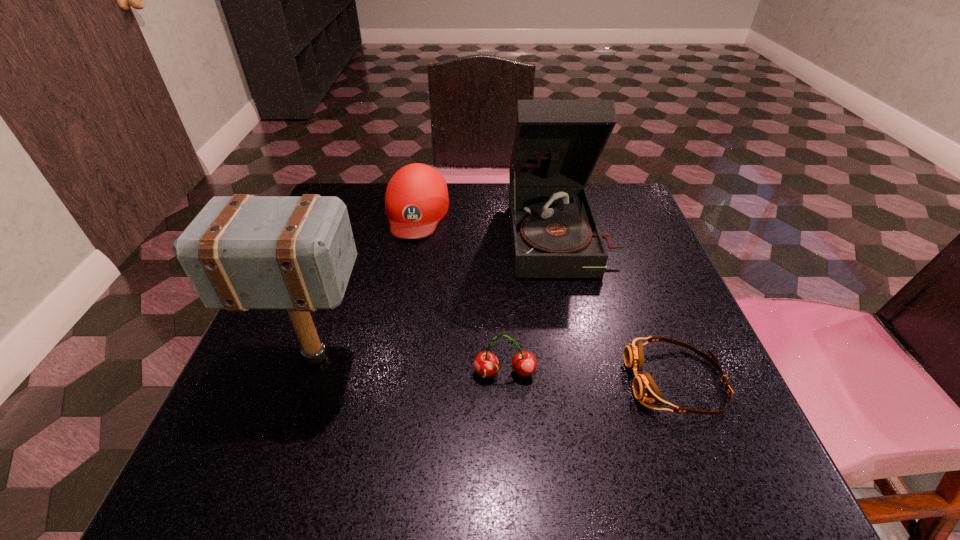
Image resolution: width=960 pixels, height=540 pixels. I want to click on free space at the left edge of the desktop, so click(264, 388).

Image resolution: width=960 pixels, height=540 pixels. What are the coordinates of `vacant position at the right edge of the desktop` in the screenshot? It's located at tap(665, 294).

Image resolution: width=960 pixels, height=540 pixels. In order to click on free space at the far left corner of the desktop in this screenshot , I will do `click(387, 187)`.

Locate an element on the screen. free space at the far right corner of the desktop is located at coordinates (602, 228).

Find the location of a particular element. This screenshot has height=540, width=960. vacant area between the cherry and the goggles is located at coordinates (590, 377).

I want to click on vacant space that is in between the mallet and the phonograph_record, so click(x=438, y=295).

Locate an element on the screen. The width and height of the screenshot is (960, 540). empty space that is in between the goggles and the baseball cap is located at coordinates (546, 296).

The width and height of the screenshot is (960, 540). Find the location of `free space between the shortest object and the baseball cap`. free space between the shortest object and the baseball cap is located at coordinates (546, 296).

Where is `vacant area that lies between the goggles and the phonograph_record`? vacant area that lies between the goggles and the phonograph_record is located at coordinates (618, 307).

The width and height of the screenshot is (960, 540). What are the coordinates of `empty location between the phonograph_record and the shortest object` in the screenshot? It's located at (618, 307).